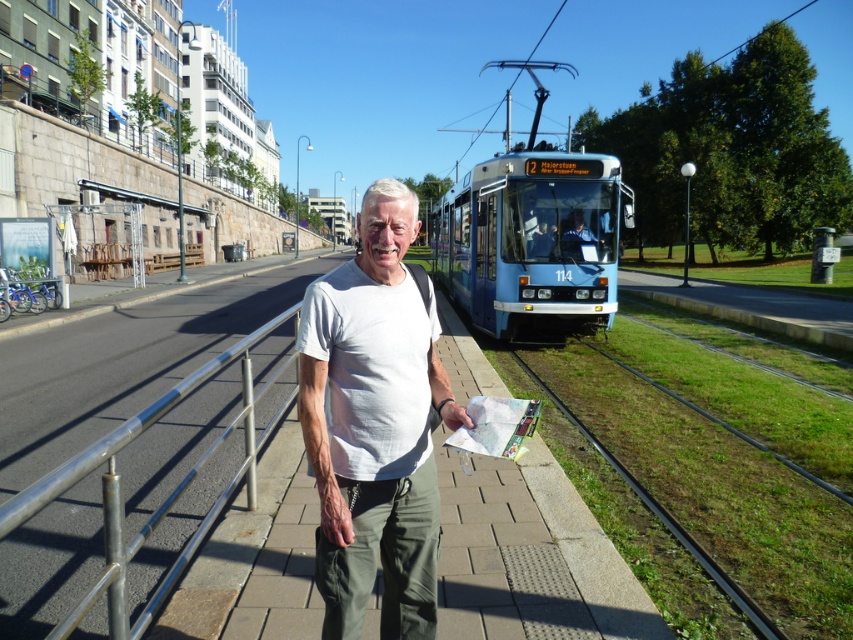
You are a delivery drone operator. Your drone is currently at the camera position. There is a delivery point marked at point [76,545]. Can your drone reach the delivery point without moving closer than 3 meters to the camera?

The point [76,545] is 4.05 meters away from the camera, so yes, the drone can reach the delivery point without moving closer than 3 meters to the camera since it is already 4.05 meters away.